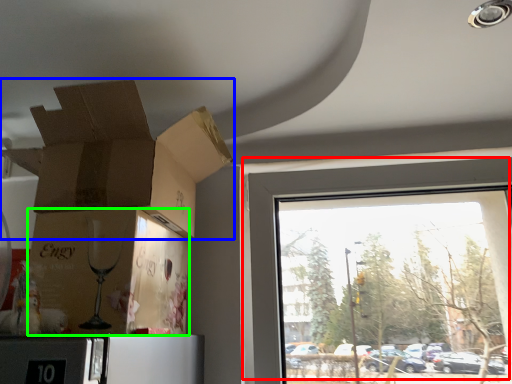
Question: Based on their relative distances, which object is nearer to window (highlighted by a red box)? Choose from cardboard box (highlighted by a blue box) and cardboard box (highlighted by a green box).

Choices:
 (A) cardboard box
 (B) cardboard box

Answer: (A)